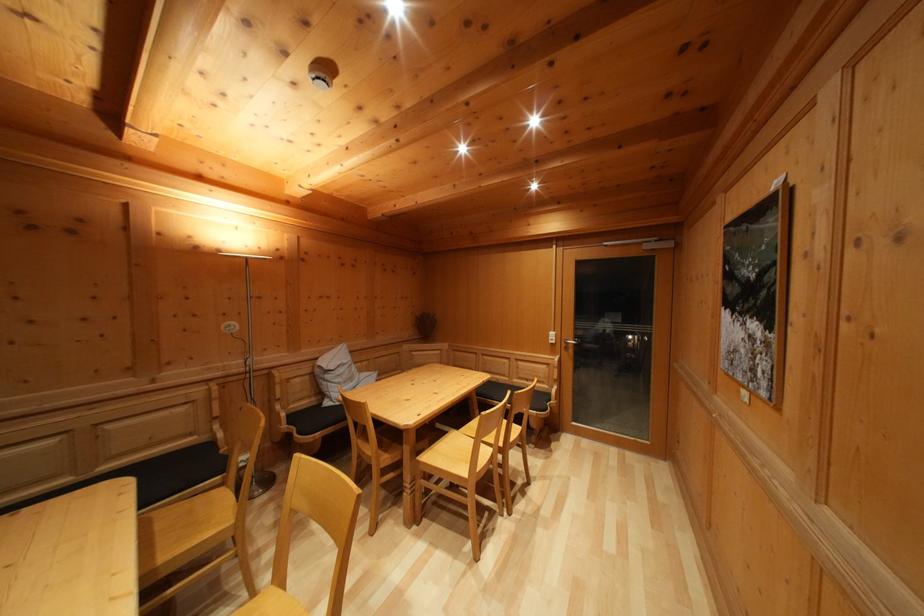
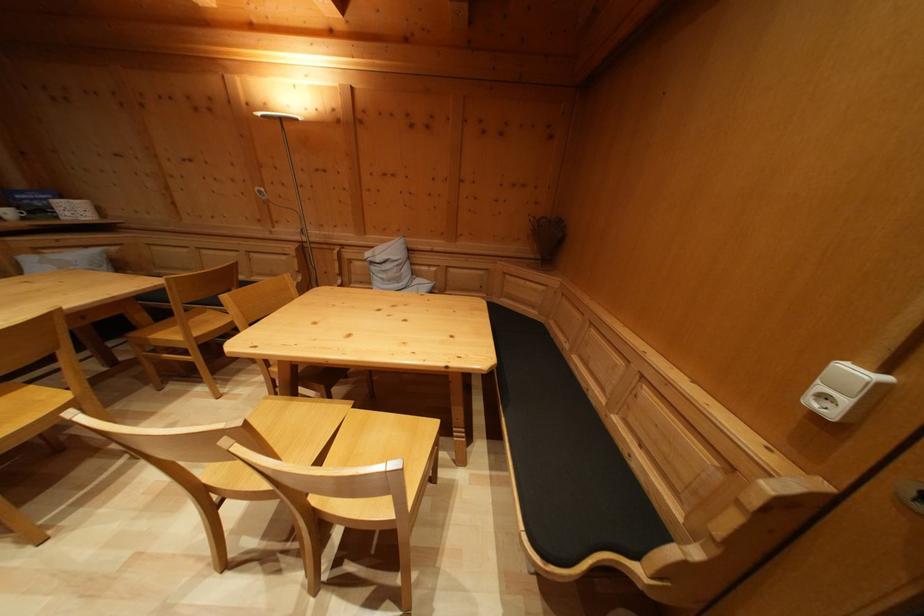
In the second image, find the point that corresponds to [558,341] in the first image.

(859, 379)